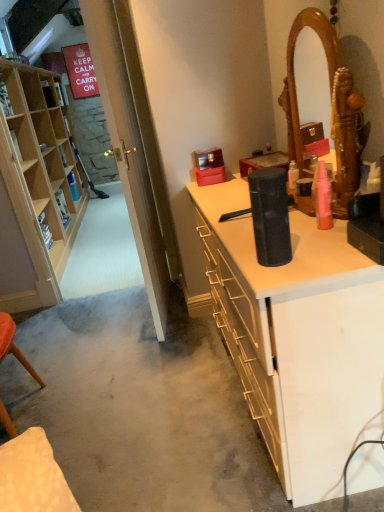
Question: Can we say black matte speaker at center lies outside pink matte spray can at upper right?

Choices:
 (A) no
 (B) yes

Answer: (B)

Question: Is black matte speaker at center thinner than pink matte spray can at upper right?

Choices:
 (A) no
 (B) yes

Answer: (A)

Question: Is black matte speaker at center taller than pink matte spray can at upper right?

Choices:
 (A) no
 (B) yes

Answer: (B)

Question: From the image's perspective, is black matte speaker at center on pink matte spray can at upper right?

Choices:
 (A) yes
 (B) no

Answer: (B)

Question: Considering the relative positions of black matte speaker at center and pink matte spray can at upper right in the image provided, is black matte speaker at center to the right of pink matte spray can at upper right from the viewer's perspective?

Choices:
 (A) yes
 (B) no

Answer: (B)

Question: Choose the correct answer: Is black matte speaker at center inside light wood cabinet at left or outside it?

Choices:
 (A) outside
 (B) inside

Answer: (A)

Question: Does point (248, 348) appear closer or farther from the camera than point (77, 164)?

Choices:
 (A) farther
 (B) closer

Answer: (B)

Question: Is black matte speaker at center to the left or to the right of light wood cabinet at left in the image?

Choices:
 (A) right
 (B) left

Answer: (A)

Question: Looking at their shapes, would you say black matte speaker at center is wider or thinner than light wood cabinet at left?

Choices:
 (A) thin
 (B) wide

Answer: (B)

Question: Is transparent glass door at left situated inside pink matte spray can at upper right or outside?

Choices:
 (A) inside
 (B) outside

Answer: (B)

Question: Is transparent glass door at left to the left or to the right of pink matte spray can at upper right in the image?

Choices:
 (A) left
 (B) right

Answer: (A)

Question: In the image, is transparent glass door at left positioned in front of or behind pink matte spray can at upper right?

Choices:
 (A) front
 (B) behind

Answer: (B)

Question: From a real-world perspective, is transparent glass door at left positioned above or below pink matte spray can at upper right?

Choices:
 (A) below
 (B) above

Answer: (B)

Question: Considering their positions, is light wood cabinet at left located in front of or behind pink matte spray can at upper right?

Choices:
 (A) front
 (B) behind

Answer: (B)

Question: From their relative heights in the image, would you say light wood cabinet at left is taller or shorter than pink matte spray can at upper right?

Choices:
 (A) tall
 (B) short

Answer: (A)